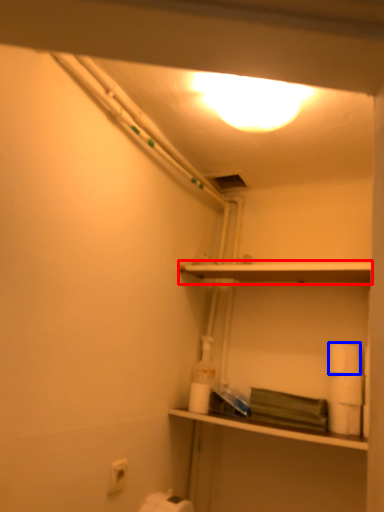
Question: Which object appears farthest to the camera in this image, shelf (highlighted by a red box) or toilet paper (highlighted by a blue box)?

Choices:
 (A) shelf
 (B) toilet paper

Answer: (B)